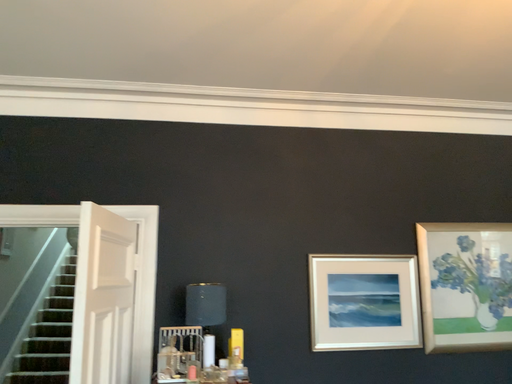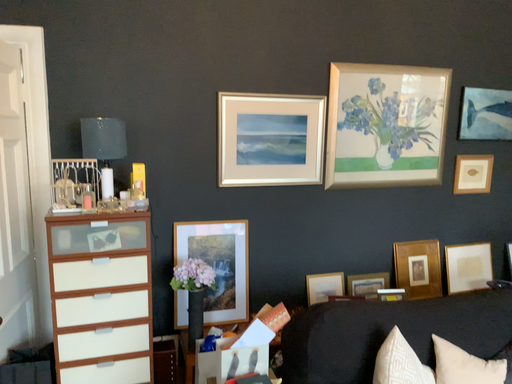
Question: Which way did the camera rotate in the video?

Choices:
 (A) rotated left
 (B) rotated right

Answer: (B)